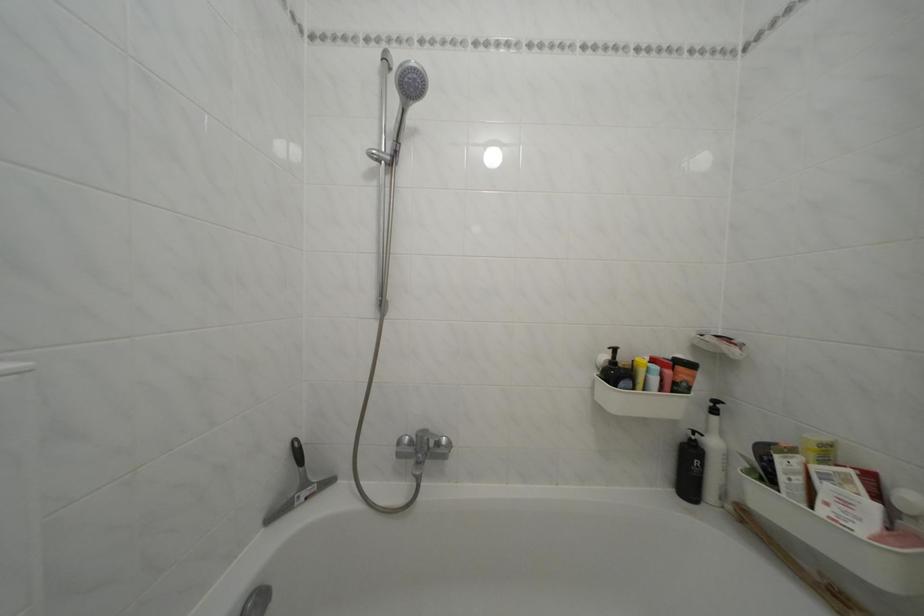
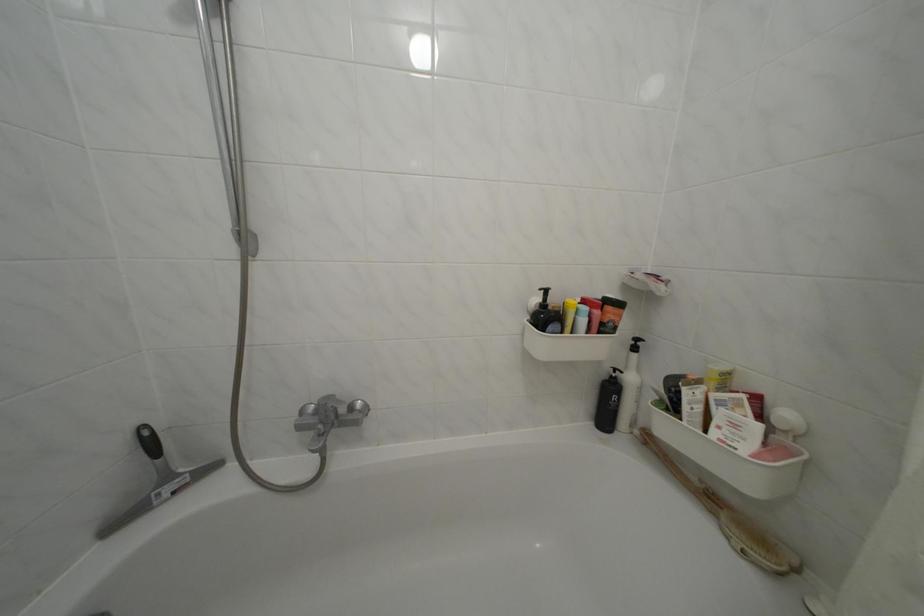
In the second image, find the point that corresponds to (x=447, y=450) in the first image.

(359, 414)